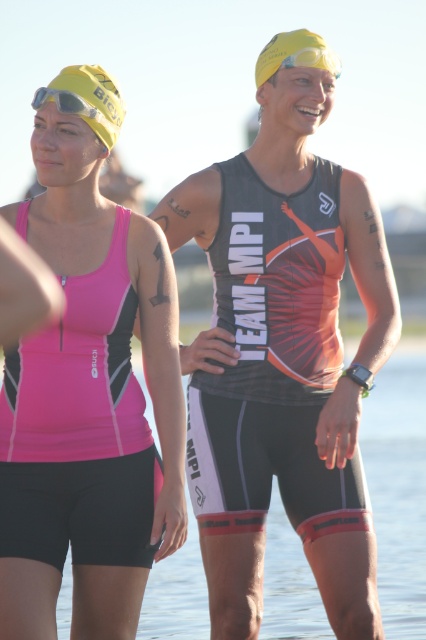
Question: Which object appears farthest from the camera in this image?

Choices:
 (A) matte black goggles at upper left
 (B) matte black triathlon suit at center
 (C) black matte triathlon suit at center

Answer: (B)

Question: Considering the real-world distances, which object is farthest from the yellow matte swim cap at upper left?

Choices:
 (A) matte black triathlon suit at center
 (B) black matte triathlon suit at center
 (C) matte black goggles at upper left
 (D) yellow matte swim cap at upper center

Answer: (A)

Question: Which of the following is the farthest from the observer?

Choices:
 (A) (71, 76)
 (B) (298, 524)

Answer: (B)

Question: Does black matte triathlon suit at center appear on the right side of matte black goggles at upper left?

Choices:
 (A) yes
 (B) no

Answer: (A)

Question: Does matte black triathlon suit at center have a smaller size compared to yellow matte swim cap at upper left?

Choices:
 (A) yes
 (B) no

Answer: (A)

Question: From the image, what is the correct spatial relationship of matte black triathlon suit at center in relation to black matte triathlon suit at center?

Choices:
 (A) below
 (B) above

Answer: (A)